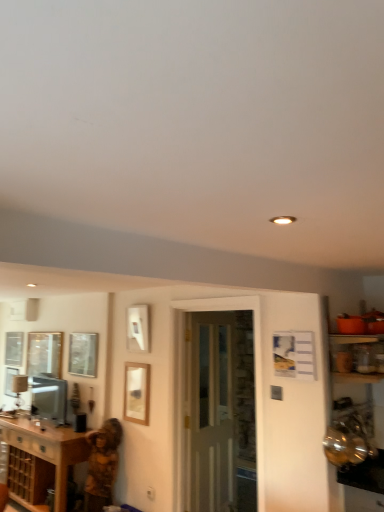
The height and width of the screenshot is (512, 384). Identify the location of clear glass window at upper center, the 2th window viewed from the left. (83, 354).

In order to face clear glass window at upper center, which ranks as the 1th window in right-to-left order, should I rotate leftwards or rightwards?

Rotate left and turn 14.236 degrees.

In order to face brown wood cabinet at lower left, should I rotate leftwards or rightwards?

To face it directly, rotate left by 19.719 degrees.

Image resolution: width=384 pixels, height=512 pixels. What are the coordinates of `clear glass door at center` in the screenshot? It's located at (211, 414).

What is the approximate width of clear glass door at center?

It is 4.77 inches.

Image resolution: width=384 pixels, height=512 pixels. Describe the element at coordinates (357, 421) in the screenshot. I see `orange plastic bowls at right` at that location.

The height and width of the screenshot is (512, 384). Identify the location of wooden picture frame at center. (136, 393).

What do you see at coordinates (136, 393) in the screenshot?
I see `wooden picture frame at center` at bounding box center [136, 393].

This screenshot has height=512, width=384. I want to click on clear glass window at upper center, the 2th window viewed from the left, so click(x=83, y=354).

Can we say matte silver television at lower left lies outside clear glass window at upper center, which is the first window in front-to-back order?

That's correct, matte silver television at lower left is outside of clear glass window at upper center, which is the first window in front-to-back order.

Could you tell me if matte silver television at lower left is facing clear glass window at upper center, which ranks as the 1th window in right-to-left order?

No, matte silver television at lower left is not facing towards clear glass window at upper center, which ranks as the 1th window in right-to-left order.

Consider the image. From a real-world perspective, which object rests below the other?

matte silver television at lower left, from a real-world perspective.

Is matte silver television at lower left placed right next to clear glass window at upper center, placed as the second window when sorted from back to front?

matte silver television at lower left is not next to clear glass window at upper center, placed as the second window when sorted from back to front, and they're not touching.

Based on their sizes in the image, would you say camouflage-patterned shirt at lower left is bigger or smaller than clear glass window at upper center, the 2th window viewed from the left?

In the image, camouflage-patterned shirt at lower left appears to be larger than clear glass window at upper center, the 2th window viewed from the left.

From the picture: From the image's perspective, is camouflage-patterned shirt at lower left beneath clear glass window at upper center, the 2th window viewed from the left?

Correct, camouflage-patterned shirt at lower left appears lower than clear glass window at upper center, the 2th window viewed from the left, in the image.

Is clear glass window at upper center, which ranks as the 1th window in right-to-left order, located within camouflage-patterned shirt at lower left?

No, clear glass window at upper center, which ranks as the 1th window in right-to-left order, is located outside of camouflage-patterned shirt at lower left.

Is camouflage-patterned shirt at lower left closer to the viewer compared to clear glass window at upper center, placed as the second window when sorted from back to front?

Yes, it is.

Is clear glass door at center surrounding clear glass window at upper center, which ranks as the 1th window in right-to-left order?

No, clear glass window at upper center, which ranks as the 1th window in right-to-left order, is not a part of clear glass door at center.

Is clear glass door at center shorter than clear glass window at upper center, which is the first window in front-to-back order?

In fact, clear glass door at center may be taller than clear glass window at upper center, which is the first window in front-to-back order.

What's the angular difference between clear glass door at center and clear glass window at upper center, the 2th window viewed from the left,'s facing directions?

102 degrees separate the facing orientations of clear glass door at center and clear glass window at upper center, the 2th window viewed from the left.

Are clear glass door at center and clear glass window at upper center, which is the first window in front-to-back order, located far from each other?

Absolutely, clear glass door at center is distant from clear glass window at upper center, which is the first window in front-to-back order.

Which object is positioned more to the left, clear glass window at upper center, placed as the second window when sorted from back to front, or orange plastic bowls at right?

Positioned to the left is clear glass window at upper center, placed as the second window when sorted from back to front.

Image resolution: width=384 pixels, height=512 pixels. In order to click on entertainment center below the clear glass window at upper center, the 2th window viewed from the left (from a real-world perspective) in this screenshot , I will do `click(357, 421)`.

Is clear glass window at upper center, which is the first window in front-to-back order, taller or shorter than orange plastic bowls at right?

In the image, clear glass window at upper center, which is the first window in front-to-back order, appears to be shorter than orange plastic bowls at right.

Which of these two, clear glass window at upper center, which ranks as the 1th window in right-to-left order, or orange plastic bowls at right, is thinner?

clear glass window at upper center, which ranks as the 1th window in right-to-left order.

Is clear glass window at center, the 2th window positioned from the right, wider or thinner than camouflage-patterned shirt at lower left?

Considering their sizes, clear glass window at center, the 2th window positioned from the right, looks slimmer than camouflage-patterned shirt at lower left.

Consider the image. Could you measure the distance between clear glass window at center, the first window when ordered from back to front, and camouflage-patterned shirt at lower left?

The distance of clear glass window at center, the first window when ordered from back to front, from camouflage-patterned shirt at lower left is 1.14 meters.

The image size is (384, 512). What are the coordinates of `the 1st window directly above the camouflage-patterned shirt at lower left (from a real-world perspective)` in the screenshot? It's located at (44, 353).

Is clear glass window at center, the 1th window positioned from the left, smaller than camouflage-patterned shirt at lower left?

Yes, clear glass window at center, the 1th window positioned from the left, is smaller than camouflage-patterned shirt at lower left.

Does orange plastic bowls at right have a smaller size compared to clear glass window at upper center, which ranks as the 1th window in right-to-left order?

Actually, orange plastic bowls at right might be larger than clear glass window at upper center, which ranks as the 1th window in right-to-left order.

Which is more to the right, orange plastic bowls at right or clear glass window at upper center, placed as the second window when sorted from back to front?

orange plastic bowls at right.

Does orange plastic bowls at right have a greater height compared to clear glass window at upper center, which is the first window in front-to-back order?

Correct, orange plastic bowls at right is much taller as clear glass window at upper center, which is the first window in front-to-back order.

Which object is closer to the camera taking this photo, wooden picture frame at center or brown wood cabinet at lower left?

brown wood cabinet at lower left is more forward.

Is wooden picture frame at center not close to brown wood cabinet at lower left?

No, there isn't a large distance between wooden picture frame at center and brown wood cabinet at lower left.

Which of these two, wooden picture frame at center or brown wood cabinet at lower left, is wider?

With larger width is brown wood cabinet at lower left.

In the image, there is a clear glass window at upper center, which is the first window in front-to-back order. Where is `appliance below it (from a real-world perspective)`? The width and height of the screenshot is (384, 512). appliance below it (from a real-world perspective) is located at coordinates (49, 398).

From the image's perspective, count 2nd windows upward from the camouflage-patterned shirt at lower left and point to it. Please provide its 2D coordinates.

[(83, 354)]

Considering their positions, is clear glass window at center, the 2th window positioned from the right, positioned closer to orange plastic bowls at right than clear glass door at center?

clear glass door at center lies closer to orange plastic bowls at right than the other object.

When comparing their distances from clear glass window at center, the first window when ordered from back to front, does brown wood cabinet at lower left or camouflage-patterned shirt at lower left seem further?

Among the two, camouflage-patterned shirt at lower left is located further to clear glass window at center, the first window when ordered from back to front.

Based on their spatial positions, is clear glass door at center or clear glass window at upper center, the 2th window viewed from the left, closer to orange plastic bowls at right?

The object closer to orange plastic bowls at right is clear glass door at center.

Consider the image. Which object lies nearer to the anchor point wooden picture frame at center, clear glass door at center or clear glass window at center, placed as the 2th window when sorted from front to back?

clear glass door at center lies closer to wooden picture frame at center than the other object.

Estimate the real-world distances between objects in this image. Which object is further from brown wood cabinet at lower left, wooden picture frame at center or camouflage-patterned shirt at lower left?

wooden picture frame at center.

Estimate the real-world distances between objects in this image. Which object is closer to clear glass window at upper center, which is the first window in front-to-back order, brown wood cabinet at lower left or camouflage-patterned shirt at lower left?

Among the two, camouflage-patterned shirt at lower left is located nearer to clear glass window at upper center, which is the first window in front-to-back order.

Considering their positions, is wooden picture frame at center positioned further to clear glass window at center, placed as the 2th window when sorted from front to back, than clear glass door at center?

clear glass door at center is further to clear glass window at center, placed as the 2th window when sorted from front to back.

Based on their spatial positions, is wooden picture frame at center or brown wood cabinet at lower left further from orange plastic bowls at right?

Among the two, brown wood cabinet at lower left is located further to orange plastic bowls at right.

The width and height of the screenshot is (384, 512). What are the coordinates of `person between matte silver television at lower left and wooden picture frame at center in the horizontal direction` in the screenshot? It's located at (102, 465).

The image size is (384, 512). What are the coordinates of `person located between clear glass window at center, the 1th window positioned from the left, and clear glass door at center in the left-right direction` in the screenshot? It's located at (102, 465).

Locate an element on the screen. The height and width of the screenshot is (512, 384). appliance between clear glass window at center, the 1th window positioned from the left, and clear glass door at center, in the horizontal direction is located at coordinates (49, 398).

The height and width of the screenshot is (512, 384). Find the location of `appliance between camouflage-patterned shirt at lower left and clear glass window at center, the first window when ordered from back to front, from front to back`. appliance between camouflage-patterned shirt at lower left and clear glass window at center, the first window when ordered from back to front, from front to back is located at coordinates (49, 398).